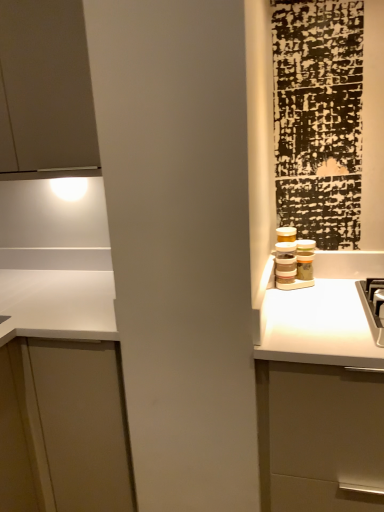
Where is `matte white cabinet at upper left, the 2th cabinetry positioned from the bottom`? Image resolution: width=384 pixels, height=512 pixels. matte white cabinet at upper left, the 2th cabinetry positioned from the bottom is located at coordinates (45, 91).

What do you see at coordinates (45, 91) in the screenshot?
I see `matte white cabinet at upper left, the first cabinetry positioned from the top` at bounding box center [45, 91].

In order to face matte white cabinet at upper left, the first cabinetry positioned from the top, should I rotate leftwards or rightwards?

You should look left and rotate roughly 20.479 degrees.

What do you see at coordinates (61, 395) in the screenshot?
I see `white matte cabinet at left, positioned as the first cabinetry in bottom-to-top order` at bounding box center [61, 395].

In order to face white matte cabinet at left, marked as the second cabinetry in a top-to-bottom arrangement, should I rotate leftwards or rightwards?

Turn left approximately 17.971 degrees to face it.

I want to click on white matte cabinet at left, marked as the second cabinetry in a top-to-bottom arrangement, so click(x=61, y=395).

This screenshot has height=512, width=384. I want to click on matte white cabinet at upper left, the 2th cabinetry positioned from the bottom, so click(45, 91).

Considering the relative positions of matte white cabinet at upper left, the 2th cabinetry positioned from the bottom, and white matte cabinet at left, positioned as the first cabinetry in bottom-to-top order, in the image provided, is matte white cabinet at upper left, the 2th cabinetry positioned from the bottom, to the left of white matte cabinet at left, positioned as the first cabinetry in bottom-to-top order, from the viewer's perspective?

Indeed, matte white cabinet at upper left, the 2th cabinetry positioned from the bottom, is positioned on the left side of white matte cabinet at left, positioned as the first cabinetry in bottom-to-top order.

Considering their positions, is matte white cabinet at upper left, the first cabinetry positioned from the top, located in front of or behind white matte cabinet at left, marked as the second cabinetry in a top-to-bottom arrangement?

matte white cabinet at upper left, the first cabinetry positioned from the top, is behind white matte cabinet at left, marked as the second cabinetry in a top-to-bottom arrangement.

Is point (7, 156) farther from viewer compared to point (73, 331)?

Yes, it is.

From the image's perspective, is matte white cabinet at upper left, the 2th cabinetry positioned from the bottom, on white matte cabinet at left, positioned as the first cabinetry in bottom-to-top order?

Correct, matte white cabinet at upper left, the 2th cabinetry positioned from the bottom, appears higher than white matte cabinet at left, positioned as the first cabinetry in bottom-to-top order, in the image.

From a real-world perspective, is matte white cabinet at upper left, the 2th cabinetry positioned from the bottom, under white matte cabinet at left, marked as the second cabinetry in a top-to-bottom arrangement?

No.

Is matte white cabinet at upper left, the first cabinetry positioned from the top, wider than white matte cabinet at left, positioned as the first cabinetry in bottom-to-top order?

In fact, matte white cabinet at upper left, the first cabinetry positioned from the top, might be narrower than white matte cabinet at left, positioned as the first cabinetry in bottom-to-top order.

Consider the image. Considering the relative sizes of matte white cabinet at upper left, the first cabinetry positioned from the top, and white matte cabinet at left, positioned as the first cabinetry in bottom-to-top order, in the image provided, is matte white cabinet at upper left, the first cabinetry positioned from the top, taller than white matte cabinet at left, positioned as the first cabinetry in bottom-to-top order,?

No, matte white cabinet at upper left, the first cabinetry positioned from the top, is not taller than white matte cabinet at left, positioned as the first cabinetry in bottom-to-top order.

Does matte white cabinet at upper left, the first cabinetry positioned from the top, have a larger size compared to white matte cabinet at left, marked as the second cabinetry in a top-to-bottom arrangement?

Actually, matte white cabinet at upper left, the first cabinetry positioned from the top, might be smaller than white matte cabinet at left, marked as the second cabinetry in a top-to-bottom arrangement.

Can we say matte white cabinet at upper left, the 2th cabinetry positioned from the bottom, lies outside white matte cabinet at left, marked as the second cabinetry in a top-to-bottom arrangement?

matte white cabinet at upper left, the 2th cabinetry positioned from the bottom, lies outside white matte cabinet at left, marked as the second cabinetry in a top-to-bottom arrangement,'s area.

Is matte white cabinet at upper left, the 2th cabinetry positioned from the bottom, in contact with white matte cabinet at left, positioned as the first cabinetry in bottom-to-top order?

matte white cabinet at upper left, the 2th cabinetry positioned from the bottom, is not next to white matte cabinet at left, positioned as the first cabinetry in bottom-to-top order, and they're not touching.

Is matte white cabinet at upper left, the 2th cabinetry positioned from the bottom, facing towards white matte cabinet at left, marked as the second cabinetry in a top-to-bottom arrangement?

No, matte white cabinet at upper left, the 2th cabinetry positioned from the bottom, is not facing towards white matte cabinet at left, marked as the second cabinetry in a top-to-bottom arrangement.

How many degrees apart are the facing directions of matte white cabinet at upper left, the first cabinetry positioned from the top, and white matte cabinet at left, marked as the second cabinetry in a top-to-bottom arrangement?

0.0281 degrees separate the facing orientations of matte white cabinet at upper left, the first cabinetry positioned from the top, and white matte cabinet at left, marked as the second cabinetry in a top-to-bottom arrangement.

In the scene shown: Measure the distance from matte white cabinet at upper left, the first cabinetry positioned from the top, to white matte cabinet at left, marked as the second cabinetry in a top-to-bottom arrangement.

matte white cabinet at upper left, the first cabinetry positioned from the top, and white matte cabinet at left, marked as the second cabinetry in a top-to-bottom arrangement, are 73.06 centimeters apart.

Where is `cabinetry to the right of matte white cabinet at upper left, the first cabinetry positioned from the top`? The width and height of the screenshot is (384, 512). cabinetry to the right of matte white cabinet at upper left, the first cabinetry positioned from the top is located at coordinates (61, 395).

Visually, is white matte cabinet at left, marked as the second cabinetry in a top-to-bottom arrangement, positioned to the left or to the right of matte white cabinet at upper left, the 2th cabinetry positioned from the bottom?

In the image, white matte cabinet at left, marked as the second cabinetry in a top-to-bottom arrangement, appears on the right side of matte white cabinet at upper left, the 2th cabinetry positioned from the bottom.

Between white matte cabinet at left, positioned as the first cabinetry in bottom-to-top order, and matte white cabinet at upper left, the 2th cabinetry positioned from the bottom, which one is positioned in front?

white matte cabinet at left, positioned as the first cabinetry in bottom-to-top order.

Does point (21, 278) come farther from viewer compared to point (31, 71)?

Yes, it is.

From the image's perspective, is white matte cabinet at left, positioned as the first cabinetry in bottom-to-top order, located beneath matte white cabinet at upper left, the 2th cabinetry positioned from the bottom?

Yes, from the image's perspective, white matte cabinet at left, positioned as the first cabinetry in bottom-to-top order, is below matte white cabinet at upper left, the 2th cabinetry positioned from the bottom.

From a real-world perspective, who is located lower, white matte cabinet at left, positioned as the first cabinetry in bottom-to-top order, or matte white cabinet at upper left, the first cabinetry positioned from the top?

white matte cabinet at left, positioned as the first cabinetry in bottom-to-top order, is physically lower.

Can you confirm if white matte cabinet at left, positioned as the first cabinetry in bottom-to-top order, is thinner than matte white cabinet at upper left, the 2th cabinetry positioned from the bottom?

Incorrect, the width of white matte cabinet at left, positioned as the first cabinetry in bottom-to-top order, is not less than that of matte white cabinet at upper left, the 2th cabinetry positioned from the bottom.

In terms of height, does white matte cabinet at left, positioned as the first cabinetry in bottom-to-top order, look taller or shorter compared to matte white cabinet at upper left, the 2th cabinetry positioned from the bottom?

white matte cabinet at left, positioned as the first cabinetry in bottom-to-top order, is taller than matte white cabinet at upper left, the 2th cabinetry positioned from the bottom.

Looking at the image, does white matte cabinet at left, marked as the second cabinetry in a top-to-bottom arrangement, seem bigger or smaller compared to matte white cabinet at upper left, the 2th cabinetry positioned from the bottom?

Clearly, white matte cabinet at left, marked as the second cabinetry in a top-to-bottom arrangement, is larger in size than matte white cabinet at upper left, the 2th cabinetry positioned from the bottom.

Is white matte cabinet at left, positioned as the first cabinetry in bottom-to-top order, completely or partially outside of matte white cabinet at upper left, the 2th cabinetry positioned from the bottom?

Absolutely, white matte cabinet at left, positioned as the first cabinetry in bottom-to-top order, is external to matte white cabinet at upper left, the 2th cabinetry positioned from the bottom.

Would you consider white matte cabinet at left, marked as the second cabinetry in a top-to-bottom arrangement, to be distant from matte white cabinet at upper left, the 2th cabinetry positioned from the bottom?

No, white matte cabinet at left, marked as the second cabinetry in a top-to-bottom arrangement, is not far away from matte white cabinet at upper left, the 2th cabinetry positioned from the bottom.

Is white matte cabinet at left, marked as the second cabinetry in a top-to-bottom arrangement, facing towards matte white cabinet at upper left, the 2th cabinetry positioned from the bottom?

No, white matte cabinet at left, marked as the second cabinetry in a top-to-bottom arrangement, is not turned towards matte white cabinet at upper left, the 2th cabinetry positioned from the bottom.

How different are the orientations of white matte cabinet at left, marked as the second cabinetry in a top-to-bottom arrangement, and matte white cabinet at upper left, the 2th cabinetry positioned from the bottom, in degrees?

white matte cabinet at left, marked as the second cabinetry in a top-to-bottom arrangement, and matte white cabinet at upper left, the 2th cabinetry positioned from the bottom, are facing 0.0281 degrees away from each other.

Image resolution: width=384 pixels, height=512 pixels. In order to click on cabinetry positioned vertically above the white matte cabinet at left, marked as the second cabinetry in a top-to-bottom arrangement (from a real-world perspective) in this screenshot , I will do `click(45, 91)`.

You are a GUI agent. You are given a task and a screenshot of the screen. Output one action in this format:
    pyautogui.click(x=<x>, y=<y>)
    Task: Click on the cabinetry that appears above the white matte cabinet at left, positioned as the first cabinetry in bottom-to-top order (from the image's perspective)
    The image size is (384, 512).
    Given the screenshot: What is the action you would take?
    pyautogui.click(x=45, y=91)

Locate an element on the screen. The width and height of the screenshot is (384, 512). cabinetry that appears behind the white matte cabinet at left, positioned as the first cabinetry in bottom-to-top order is located at coordinates (45, 91).